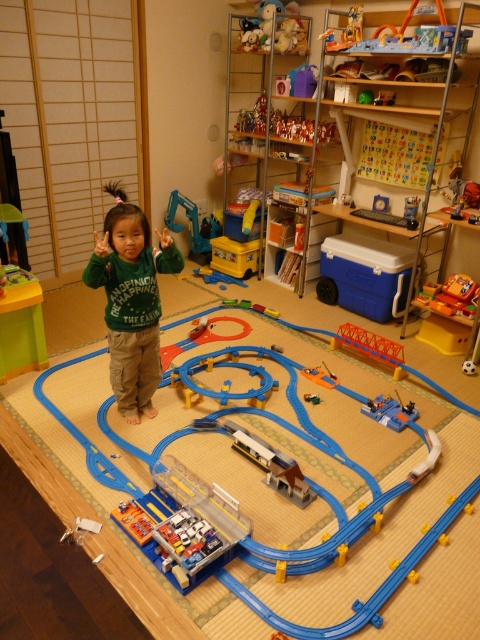
Question: Based on their relative distances, which object is farther from the blue plastic train at lower right?

Choices:
 (A) orange plastic train at center
 (B) green fleece sweater at center
 (C) wooden train at center

Answer: (B)

Question: Does blue plastic train at center have a larger size compared to green fleece sweater at center?

Choices:
 (A) no
 (B) yes

Answer: (B)

Question: Which object is positioned farthest from the blue plastic train at lower right?

Choices:
 (A) blue plastic train at center
 (B) orange plastic train at center

Answer: (A)

Question: Can you confirm if blue plastic excavator at center is positioned below orange plastic train at center?

Choices:
 (A) yes
 (B) no

Answer: (B)

Question: Does green fleece sweater at center appear under wooden train at center?

Choices:
 (A) no
 (B) yes

Answer: (A)

Question: Based on their relative distances, which object is nearer to the wooden train at center?

Choices:
 (A) green fleece sweater at center
 (B) blue plastic train at lower right
 (C) blue plastic excavator at center
 (D) orange plastic train at center

Answer: (B)